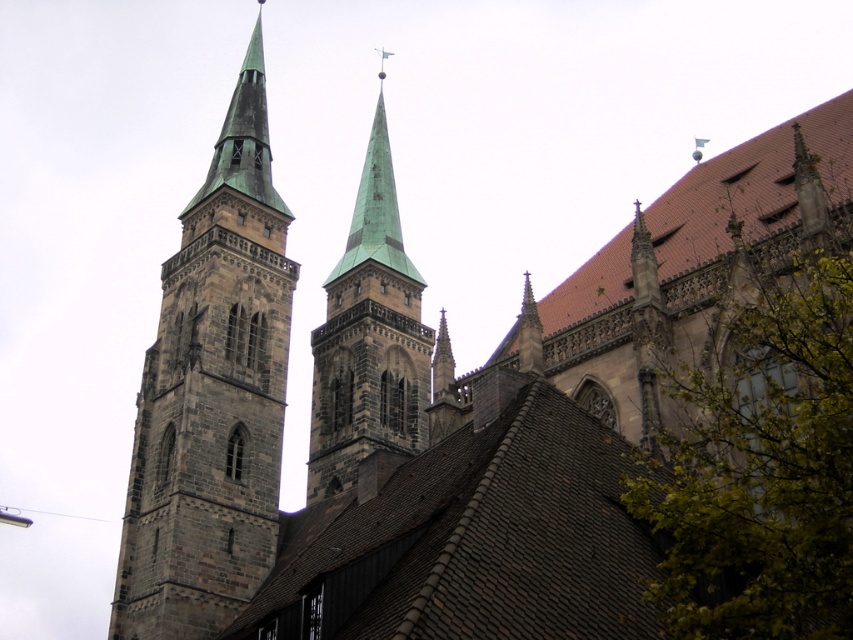
Is dark gray stone tower at left to the left of green copper steeple at center from the viewer's perspective?

Yes, dark gray stone tower at left is to the left of green copper steeple at center.

Can you confirm if dark gray stone tower at left is taller than green copper steeple at center?

No.

Where is `dark gray stone tower at left`? The height and width of the screenshot is (640, 853). dark gray stone tower at left is located at coordinates (212, 396).

Between green leafy tree at right and dark gray stone tower at left, which one is positioned higher?

Positioned higher is dark gray stone tower at left.

Does green leafy tree at right lie behind dark gray stone tower at left?

No, green leafy tree at right is closer to the viewer.

Which is in front, point (821, 253) or point (218, 438)?

Positioned in front is point (821, 253).

You are a GUI agent. You are given a task and a screenshot of the screen. Output one action in this format:
    pyautogui.click(x=<x>, y=<y>)
    Task: Click on the green leafy tree at right
    Image resolution: width=853 pixels, height=640 pixels.
    Given the screenshot: What is the action you would take?
    pyautogui.click(x=759, y=461)

Is green leafy tree at right positioned before green copper steeple at center?

Yes, it is.

This screenshot has height=640, width=853. In order to click on green leafy tree at right in this screenshot , I will do `click(759, 461)`.

Where is `green leafy tree at right`? This screenshot has height=640, width=853. green leafy tree at right is located at coordinates (759, 461).